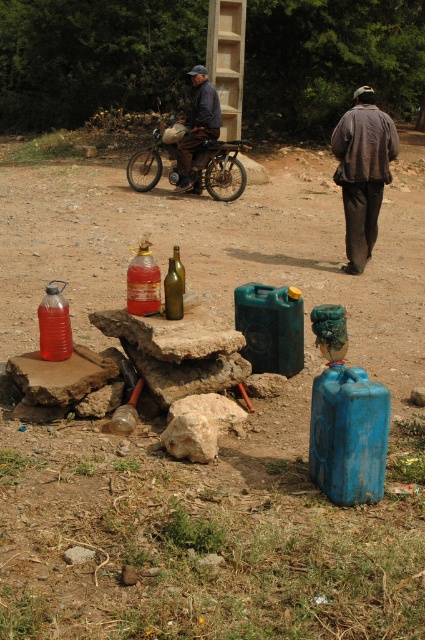
Is brown fabric jacket at upper right bigger than translucent plastic bottle at left?

Yes, brown fabric jacket at upper right is bigger than translucent plastic bottle at left.

Can you confirm if brown fabric jacket at upper right is taller than translucent plastic bottle at left?

Yes.

At what (x,y) coordinates should I click in order to perform the action: click on brown fabric jacket at upper right. Please return your answer as a coordinate pair (x, y). Looking at the image, I should click on (362, 172).

This screenshot has height=640, width=425. Identify the location of brown fabric jacket at upper right. (362, 172).

Between point (136, 176) and point (172, 308), which one is positioned behind?

The point (136, 176) is behind.

Based on the photo, between metallic silver motorcycle at center and green glass bottle at center, which one appears on the left side from the viewer's perspective?

From the viewer's perspective, metallic silver motorcycle at center appears more on the left side.

Locate an element on the screen. Image resolution: width=425 pixels, height=640 pixels. metallic silver motorcycle at center is located at coordinates (218, 168).

Locate an element on the screen. This screenshot has height=640, width=425. metallic silver motorcycle at center is located at coordinates (218, 168).

Is point (153, 132) more distant than point (59, 300)?

Yes, point (153, 132) is behind point (59, 300).

Between metallic silver motorcycle at center and translucent plastic bottle at left, which one appears on the right side from the viewer's perspective?

metallic silver motorcycle at center is more to the right.

Is point (223, 147) closer to camera compared to point (45, 304)?

No, (223, 147) is behind (45, 304).

Locate an element on the screen. The height and width of the screenshot is (640, 425). metallic silver motorcycle at center is located at coordinates (218, 168).